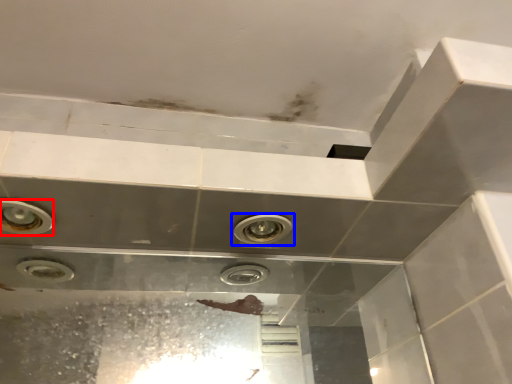
Question: Which point is further to the camera, bubble (highlighted by a red box) or plumbing fixture (highlighted by a blue box)?

Choices:
 (A) bubble
 (B) plumbing fixture

Answer: (B)